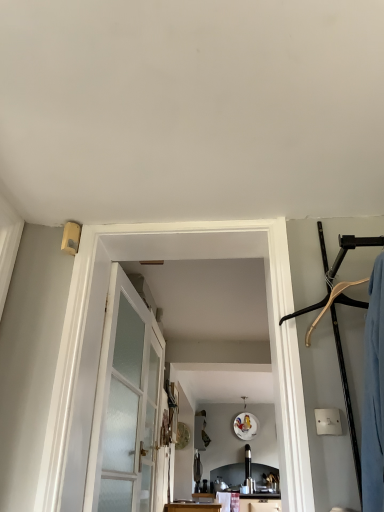
Question: From the image's perspective, is clear glass door at center on satin glass door at center?

Choices:
 (A) yes
 (B) no

Answer: (B)

Question: Does clear glass door at center have a greater width compared to satin glass door at center?

Choices:
 (A) no
 (B) yes

Answer: (A)

Question: Is clear glass door at center thinner than satin glass door at center?

Choices:
 (A) no
 (B) yes

Answer: (B)

Question: Is clear glass door at center facing towards satin glass door at center?

Choices:
 (A) no
 (B) yes

Answer: (A)

Question: Considering the relative sizes of clear glass door at center and satin glass door at center in the image provided, is clear glass door at center taller than satin glass door at center?

Choices:
 (A) yes
 (B) no

Answer: (A)

Question: Based on their positions, is clear glass door at center located to the left or right of satin glass door at center?

Choices:
 (A) right
 (B) left

Answer: (A)

Question: Looking at the image, does clear glass door at center seem bigger or smaller compared to satin glass door at center?

Choices:
 (A) small
 (B) big

Answer: (B)

Question: Considering the positions of clear glass door at center and satin glass door at center in the image, is clear glass door at center wider or thinner than satin glass door at center?

Choices:
 (A) wide
 (B) thin

Answer: (B)

Question: Which is correct: clear glass door at center is inside satin glass door at center, or outside of it?

Choices:
 (A) inside
 (B) outside

Answer: (B)

Question: Considering the positions of satin glass door at center and white frosted glass barn door at center in the image, is satin glass door at center bigger or smaller than white frosted glass barn door at center?

Choices:
 (A) big
 (B) small

Answer: (B)

Question: In the image, is satin glass door at center on the left side or the right side of white frosted glass barn door at center?

Choices:
 (A) left
 (B) right

Answer: (A)

Question: From a real-world perspective, is satin glass door at center positioned above or below white frosted glass barn door at center?

Choices:
 (A) above
 (B) below

Answer: (B)

Question: Does point (114, 330) appear closer or farther from the camera than point (91, 503)?

Choices:
 (A) closer
 (B) farther

Answer: (B)

Question: From their relative heights in the image, would you say satin glass door at center is taller or shorter than clear glass door at center?

Choices:
 (A) short
 (B) tall

Answer: (A)

Question: From a real-world perspective, relative to clear glass door at center, is satin glass door at center vertically above or below?

Choices:
 (A) below
 (B) above

Answer: (A)